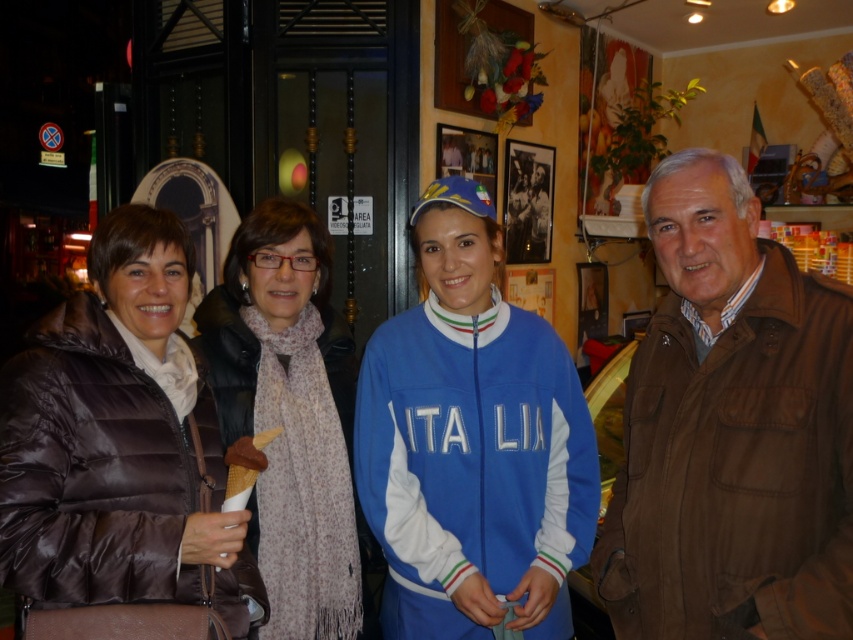
Question: Which point is farther to the camera?

Choices:
 (A) light brown scarf at center
 (B) brown leather jacket at right
 (C) brown quilted jacket at left

Answer: (A)

Question: Which of these objects is positioned farthest from the brown quilted jacket at left?

Choices:
 (A) brown quilted jacket at center
 (B) brown leather jacket at right
 (C) blue fabric jacket at center

Answer: (B)

Question: Can you confirm if brown quilted jacket at center is bigger than blue fabric jacket at center?

Choices:
 (A) no
 (B) yes

Answer: (B)

Question: In this image, where is brown quilted jacket at center located relative to light brown scarf at center?

Choices:
 (A) left
 (B) right

Answer: (B)

Question: Considering the real-world distances, which object is closest to the brown leather jacket at right?

Choices:
 (A) brown quilted jacket at left
 (B) brown quilted jacket at center
 (C) blue fabric jacket at center
 (D) light brown scarf at center

Answer: (C)

Question: Does blue fabric jacket at center appear on the right side of light brown scarf at center?

Choices:
 (A) no
 (B) yes

Answer: (B)